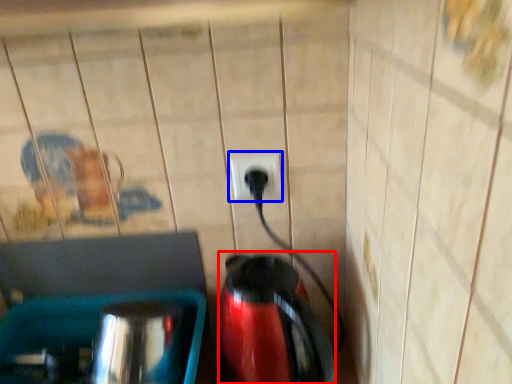
Question: Which of the following is the farthest to the observer, coffeepot (highlighted by a red box) or power plugs and sockets (highlighted by a blue box)?

Choices:
 (A) coffeepot
 (B) power plugs and sockets

Answer: (B)